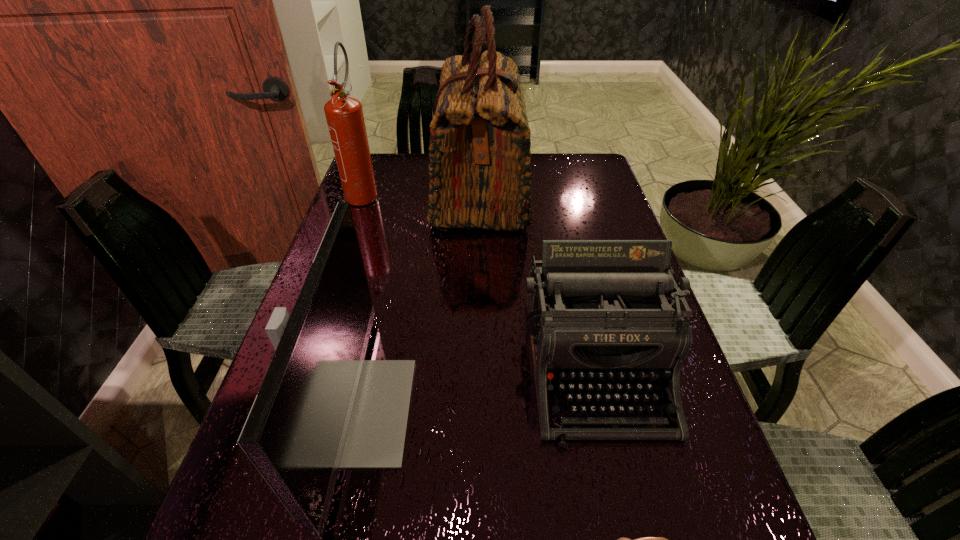
Identify the location of object that is the third closest to the third shortest object. (480, 177).